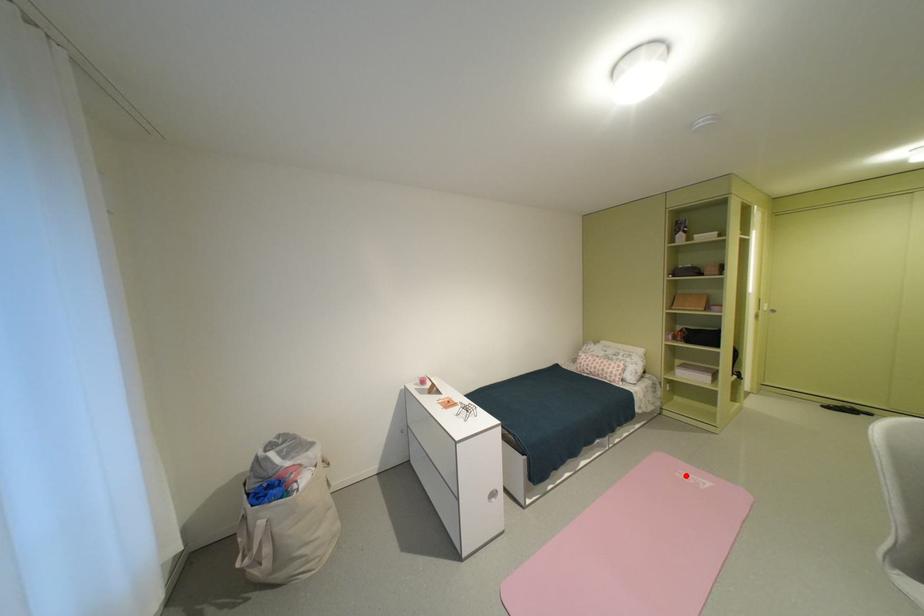
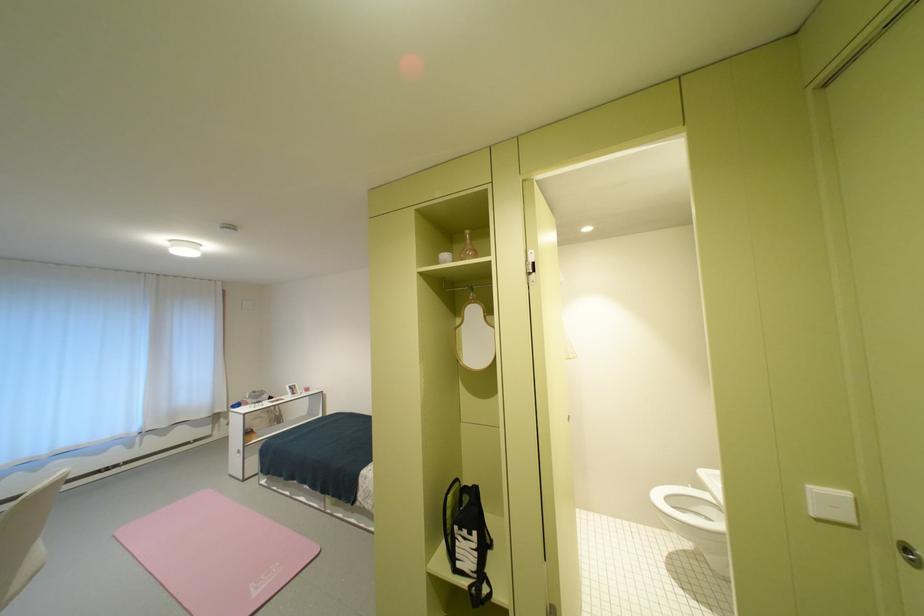
Find the pixel in the second image that matches the highlighted location in the first image.

(286, 565)